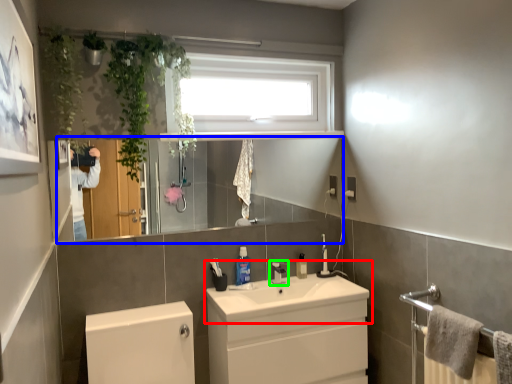
Question: Which object is the farthest from sink (highlighted by a red box)? Choose among these: mirror (highlighted by a blue box) or tap (highlighted by a green box).

Choices:
 (A) mirror
 (B) tap

Answer: (A)